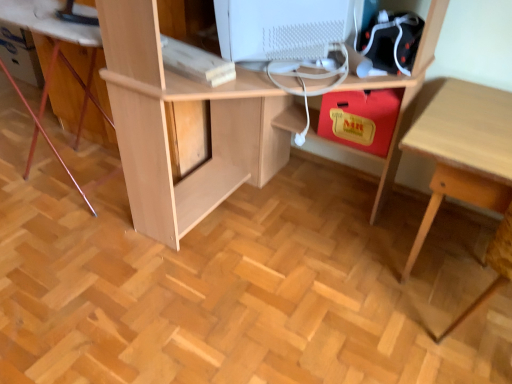
Locate an element on the screen. This screenshot has width=512, height=384. vacant space underneath light wood desk at center (from a real-world perspective) is located at coordinates (288, 216).